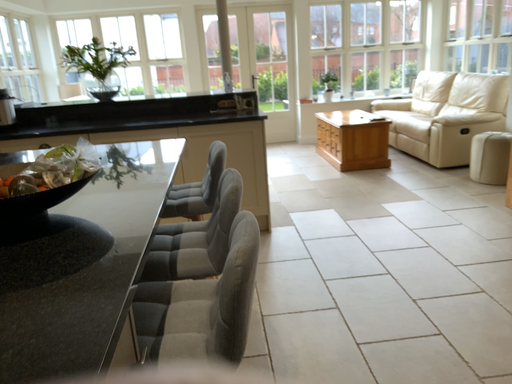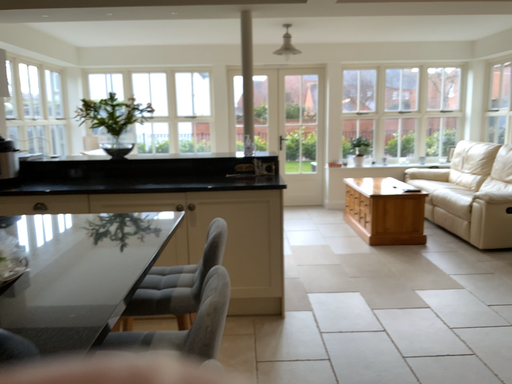
Question: Which way did the camera rotate in the video?

Choices:
 (A) rotated downward
 (B) rotated upward

Answer: (B)